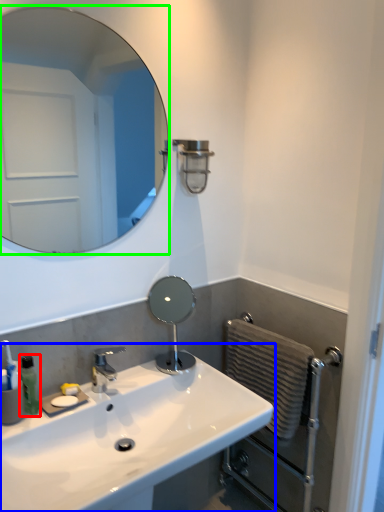
Question: Which is farther away from soap dispenser (highlighted by a red box)? sink (highlighted by a blue box) or mirror (highlighted by a green box)?

Choices:
 (A) sink
 (B) mirror

Answer: (B)